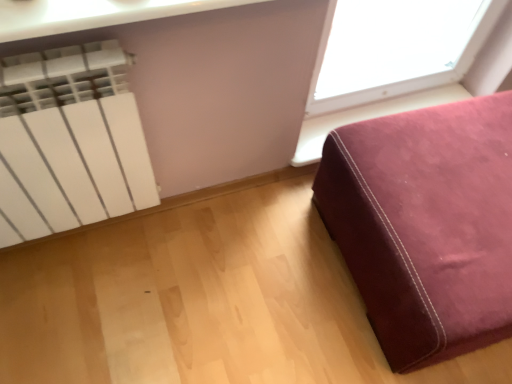
Where is `white matte radiator at upper left`? The height and width of the screenshot is (384, 512). white matte radiator at upper left is located at coordinates tap(71, 139).

The width and height of the screenshot is (512, 384). Describe the element at coordinates (71, 139) in the screenshot. I see `white matte radiator at upper left` at that location.

What is the approximate height of white matte radiator at upper left?

It is 25.89 inches.

You are a GUI agent. You are given a task and a screenshot of the screen. Output one action in this format:
    pyautogui.click(x=<x>, y=<y>)
    Task: Click on the velvet-like burgundy ottoman at lower right
    The height and width of the screenshot is (384, 512).
    Given the screenshot: What is the action you would take?
    pyautogui.click(x=426, y=225)

What is the approximate width of velvet-like burgundy ottoman at lower right?

velvet-like burgundy ottoman at lower right is 28.30 inches wide.

Describe the element at coordinates (426, 225) in the screenshot. I see `velvet-like burgundy ottoman at lower right` at that location.

Where is `white matte radiator at upper left`? white matte radiator at upper left is located at coordinates (71, 139).

Visually, is velvet-like burgundy ottoman at lower right positioned to the left or to the right of white matte radiator at upper left?

From the image, it's evident that velvet-like burgundy ottoman at lower right is to the right of white matte radiator at upper left.

Does velvet-like burgundy ottoman at lower right lie behind white matte radiator at upper left?

Yes, velvet-like burgundy ottoman at lower right is behind white matte radiator at upper left.

Does point (383, 322) appear closer or farther from the camera than point (108, 63)?

Point (383, 322) is positioned farther from the camera compared to point (108, 63).

From the image's perspective, between velvet-like burgundy ottoman at lower right and white matte radiator at upper left, which one is located above?

From the image's view, white matte radiator at upper left is above.

From a real-world perspective, is velvet-like burgundy ottoman at lower right physically below white matte radiator at upper left?

Correct, in the physical world, velvet-like burgundy ottoman at lower right is lower than white matte radiator at upper left.

Is velvet-like burgundy ottoman at lower right thinner than white matte radiator at upper left?

Incorrect, the width of velvet-like burgundy ottoman at lower right is not less than that of white matte radiator at upper left.

Considering the relative sizes of velvet-like burgundy ottoman at lower right and white matte radiator at upper left in the image provided, is velvet-like burgundy ottoman at lower right shorter than white matte radiator at upper left?

Yes, velvet-like burgundy ottoman at lower right is shorter than white matte radiator at upper left.

Considering the sizes of objects velvet-like burgundy ottoman at lower right and white matte radiator at upper left in the image provided, who is smaller, velvet-like burgundy ottoman at lower right or white matte radiator at upper left?

With smaller size is white matte radiator at upper left.

Can white matte radiator at upper left be found inside velvet-like burgundy ottoman at lower right?

No, white matte radiator at upper left is not a part of velvet-like burgundy ottoman at lower right.

Is velvet-like burgundy ottoman at lower right touching white matte radiator at upper left?

No, velvet-like burgundy ottoman at lower right is not touching white matte radiator at upper left.

Is velvet-like burgundy ottoman at lower right facing away from white matte radiator at upper left?

That's not correct — velvet-like burgundy ottoman at lower right is not looking away from white matte radiator at upper left.

Identify the location of radiator on the left of velvet-like burgundy ottoman at lower right. This screenshot has height=384, width=512. (71, 139).

Between white matte radiator at upper left and velvet-like burgundy ottoman at lower right, which one appears on the right side from the viewer's perspective?

From the viewer's perspective, velvet-like burgundy ottoman at lower right appears more on the right side.

Consider the image. Between white matte radiator at upper left and velvet-like burgundy ottoman at lower right, which one is positioned in front?

white matte radiator at upper left is in front.

Which is more distant, (106,97) or (327,190)?

The point (327,190) is behind.

From the image's perspective, is white matte radiator at upper left beneath velvet-like burgundy ottoman at lower right?

No, from the image's perspective, white matte radiator at upper left is not below velvet-like burgundy ottoman at lower right.

From a real-world perspective, is white matte radiator at upper left physically below velvet-like burgundy ottoman at lower right?

No, from a real-world perspective, white matte radiator at upper left is not beneath velvet-like burgundy ottoman at lower right.

Between white matte radiator at upper left and velvet-like burgundy ottoman at lower right, which one has larger width?

With larger width is velvet-like burgundy ottoman at lower right.

Considering the sizes of objects white matte radiator at upper left and velvet-like burgundy ottoman at lower right in the image provided, who is shorter, white matte radiator at upper left or velvet-like burgundy ottoman at lower right?

velvet-like burgundy ottoman at lower right.

Which of these two, white matte radiator at upper left or velvet-like burgundy ottoman at lower right, is bigger?

velvet-like burgundy ottoman at lower right is bigger.

Can velvet-like burgundy ottoman at lower right be found inside white matte radiator at upper left?

Definitely not — velvet-like burgundy ottoman at lower right is not inside white matte radiator at upper left.

Does white matte radiator at upper left touch velvet-like burgundy ottoman at lower right?

No, white matte radiator at upper left is not beside velvet-like burgundy ottoman at lower right.

Is velvet-like burgundy ottoman at lower right at the back of white matte radiator at upper left?

No, white matte radiator at upper left is not facing away from velvet-like burgundy ottoman at lower right.

What's the angular difference between white matte radiator at upper left and velvet-like burgundy ottoman at lower right's facing directions?

white matte radiator at upper left and velvet-like burgundy ottoman at lower right are facing 1.77 degrees away from each other.

Locate an element on the screen. This screenshot has height=384, width=512. furniture on the right of white matte radiator at upper left is located at coordinates (426, 225).

Locate an element on the screen. Image resolution: width=512 pixels, height=384 pixels. radiator on the left of the velvet-like burgundy ottoman at lower right is located at coordinates (71, 139).

The image size is (512, 384). I want to click on radiator located above the velvet-like burgundy ottoman at lower right (from the image's perspective), so click(71, 139).